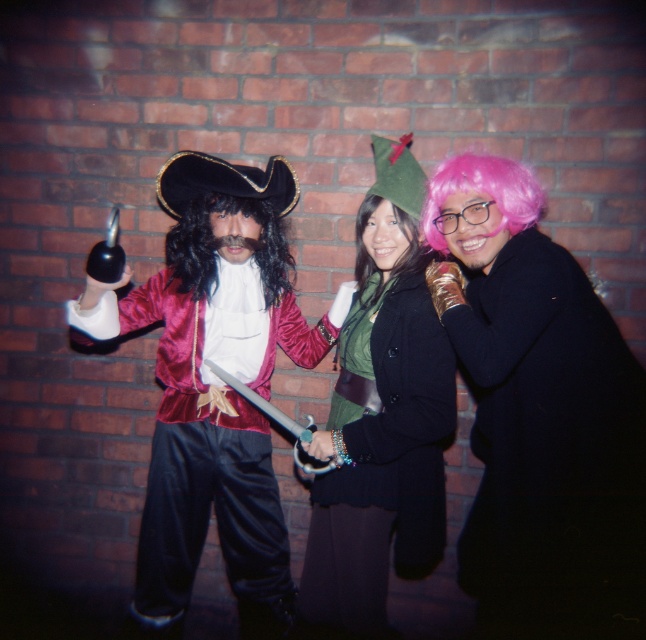
You are a photographer setting up for a group photo. You need to ensure that the pink fuzzy wig at right and the velvet pirate costume at left are visible in the frame. Given their heights, which costume should be placed closer to the front of the group to ensure both are visible?

The pink fuzzy wig at right is shorter than the velvet pirate costume at left, so placing the pink fuzzy wig at right closer to the front will ensure both are visible in the frame.